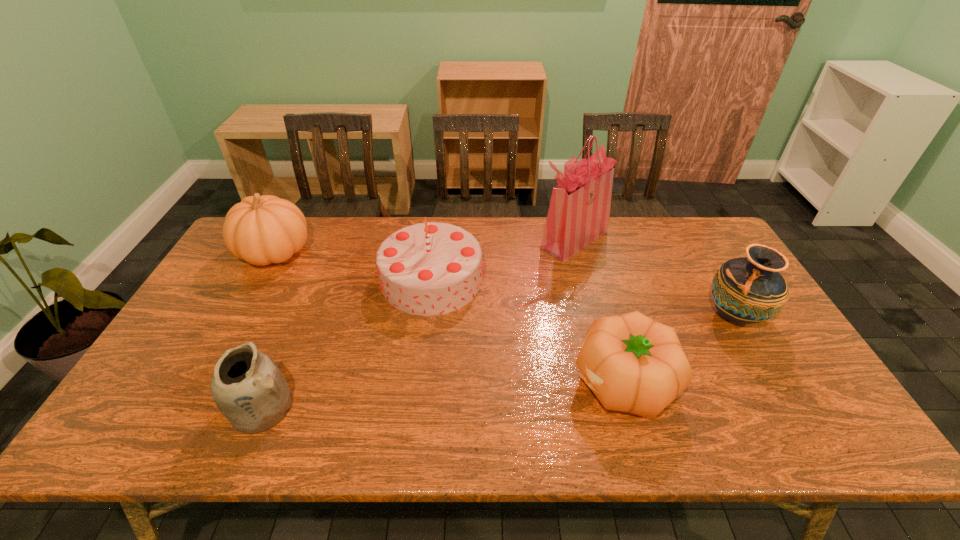
Where is `pumpkin that is positioned at the far edge`? The width and height of the screenshot is (960, 540). pumpkin that is positioned at the far edge is located at coordinates (261, 230).

The height and width of the screenshot is (540, 960). What are the coordinates of `pumpkin located in the near edge section of the desktop` in the screenshot? It's located at (633, 364).

Locate an element on the screen. The height and width of the screenshot is (540, 960). pottery that is at the near edge is located at coordinates (249, 389).

Where is `object that is positioned at the left edge`? Image resolution: width=960 pixels, height=540 pixels. object that is positioned at the left edge is located at coordinates (261, 230).

Locate an element on the screen. Image resolution: width=960 pixels, height=540 pixels. object located at the right edge is located at coordinates (746, 290).

Locate an element on the screen. This screenshot has height=540, width=960. object that is at the far left corner is located at coordinates (261, 230).

In the image, there is a desktop. Identify the location of vacant area at the far edge. Image resolution: width=960 pixels, height=540 pixels. (641, 232).

Where is `free space at the near edge of the desktop`? The width and height of the screenshot is (960, 540). free space at the near edge of the desktop is located at coordinates (378, 441).

At what (x,y) coordinates should I click in order to perform the action: click on free space at the left edge of the desktop. Please return your answer as a coordinate pair (x, y). Looking at the image, I should click on (151, 374).

Image resolution: width=960 pixels, height=540 pixels. I want to click on free spot between the shorter pottery and the shopping bag, so click(x=418, y=323).